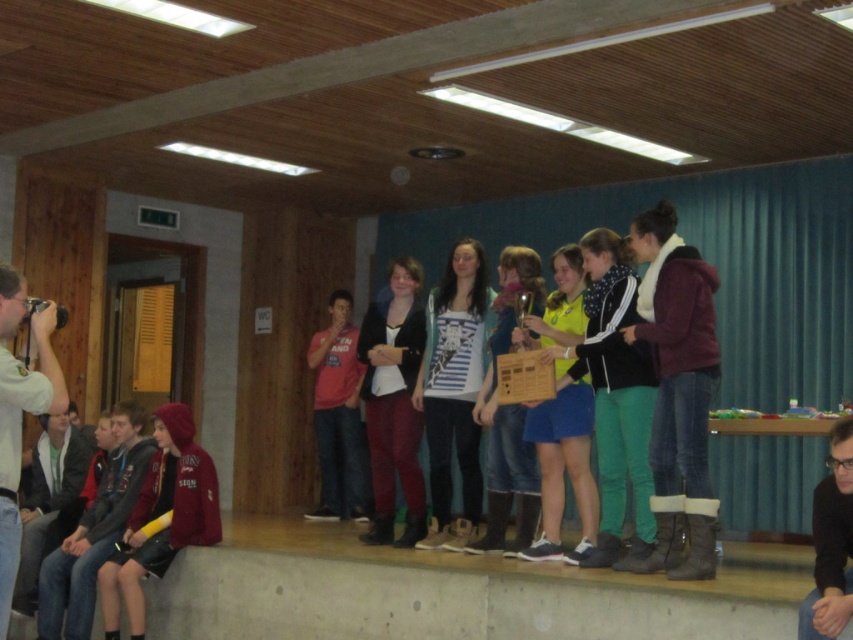
Is maroon fleece jacket at right closer to the viewer compared to white fabric camera at left?

No.

Is maroon fleece jacket at right thinner than white fabric camera at left?

No, maroon fleece jacket at right is not thinner than white fabric camera at left.

Who is more forward, [693,468] or [9,605]?

Point [9,605] is more forward.

Where is `maroon fleece jacket at right`? This screenshot has height=640, width=853. maroon fleece jacket at right is located at coordinates (677, 392).

Which is more to the right, dark gray hoodie at lower left or black matte jacket at lower right?

Positioned to the right is black matte jacket at lower right.

Does dark gray hoodie at lower left have a greater width compared to black matte jacket at lower right?

Yes.

Describe the element at coordinates (94, 531) in the screenshot. I see `dark gray hoodie at lower left` at that location.

You are a GUI agent. You are given a task and a screenshot of the screen. Output one action in this format:
    pyautogui.click(x=<x>, y=<y>)
    Task: Click on the dark gray hoodie at lower left
    
    Given the screenshot: What is the action you would take?
    pyautogui.click(x=94, y=531)

Between matte black jacket at center and dark gray hoodie at lower left, which one has more height?

matte black jacket at center

How far apart are matte black jacket at center and dark gray hoodie at lower left?

6.04 feet

Does point (409, 428) come farther from viewer compared to point (144, 445)?

No, it is in front of (144, 445).

I want to click on matte black jacket at center, so click(x=393, y=404).